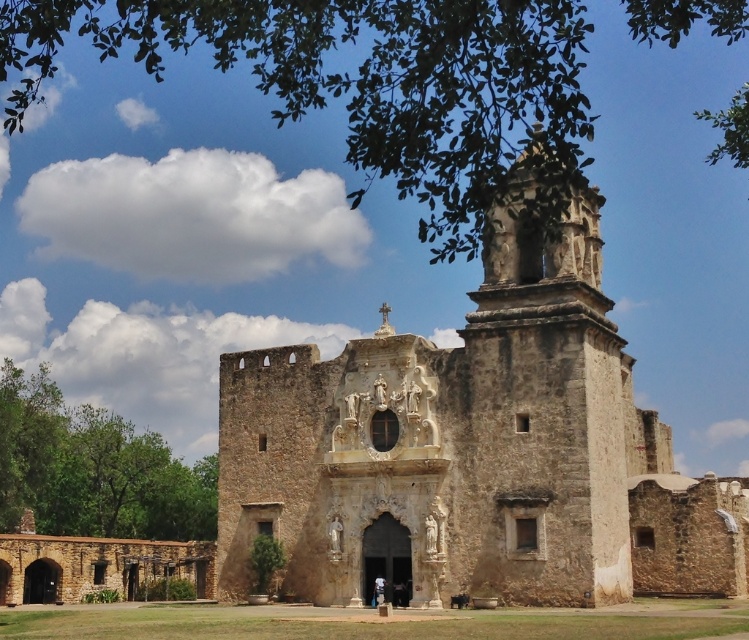
Does green leafy tree at upper center have a smaller size compared to green leafy tree at lower left?

Incorrect, green leafy tree at upper center is not smaller in size than green leafy tree at lower left.

Looking at this image, does green leafy tree at upper center have a greater height compared to green leafy tree at lower left?

Yes.

Between point (533, 120) and point (6, 428), which one is positioned behind?

The point (533, 120) is more distant.

Where is `green leafy tree at upper center`? green leafy tree at upper center is located at coordinates (372, 86).

Which is more to the right, stone church at center or white cotton shirt at center?

stone church at center is more to the right.

Does stone church at center lie behind white cotton shirt at center?

No, stone church at center is in front of white cotton shirt at center.

Does point (225, 387) come in front of point (380, 595)?

No, (225, 387) is further to viewer.

The width and height of the screenshot is (749, 640). I want to click on stone church at center, so click(470, 451).

Does stone church at center appear on the right side of green leafy tree at upper center?

Correct, you'll find stone church at center to the right of green leafy tree at upper center.

Is stone church at center closer to camera compared to green leafy tree at upper center?

No, stone church at center is further to the viewer.

Is point (539, 465) more distant than point (351, 196)?

No.

This screenshot has width=749, height=640. Find the location of `stone church at center`. stone church at center is located at coordinates (470, 451).